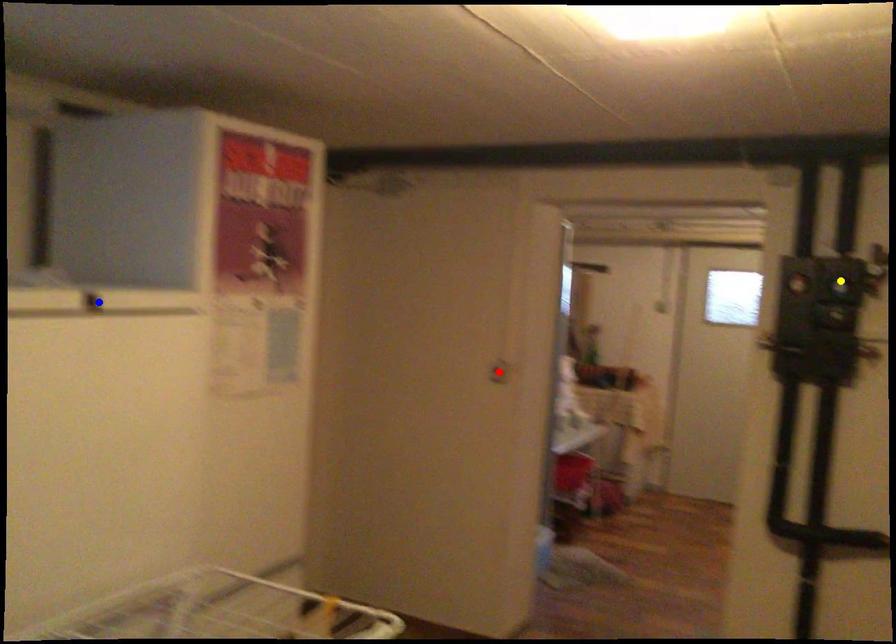
Order these from nearest to farthest:
A) blue point
B) yellow point
C) red point

blue point → yellow point → red point